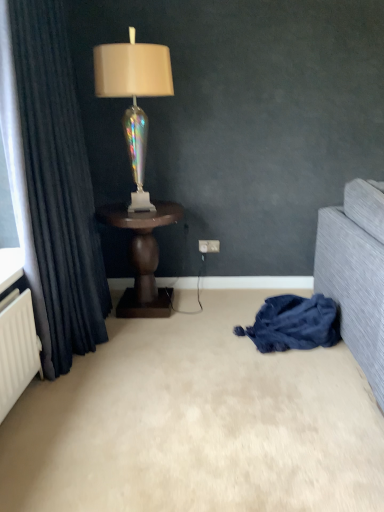
Question: From the image's perspective, is beige carpet at lower center positioned above or below iridescent glass lamp at center?

Choices:
 (A) above
 (B) below

Answer: (B)

Question: From a real-world perspective, is beige carpet at lower center physically located above or below iridescent glass lamp at center?

Choices:
 (A) above
 (B) below

Answer: (B)

Question: Based on their relative distances, which object is farther from the dark blue fabric at lower right?

Choices:
 (A) iridescent glass lamp at center
 (B) white plastic electric outlet at center
 (C) dark blue textured curtain at left
 (D) dark wood side table at center
 (E) beige carpet at lower center

Answer: (A)

Question: Which object is positioned closest to the white plastic electric outlet at center?

Choices:
 (A) iridescent glass lamp at center
 (B) beige carpet at lower center
 (C) dark blue fabric at lower right
 (D) dark blue textured curtain at left
 (E) dark wood side table at center

Answer: (E)